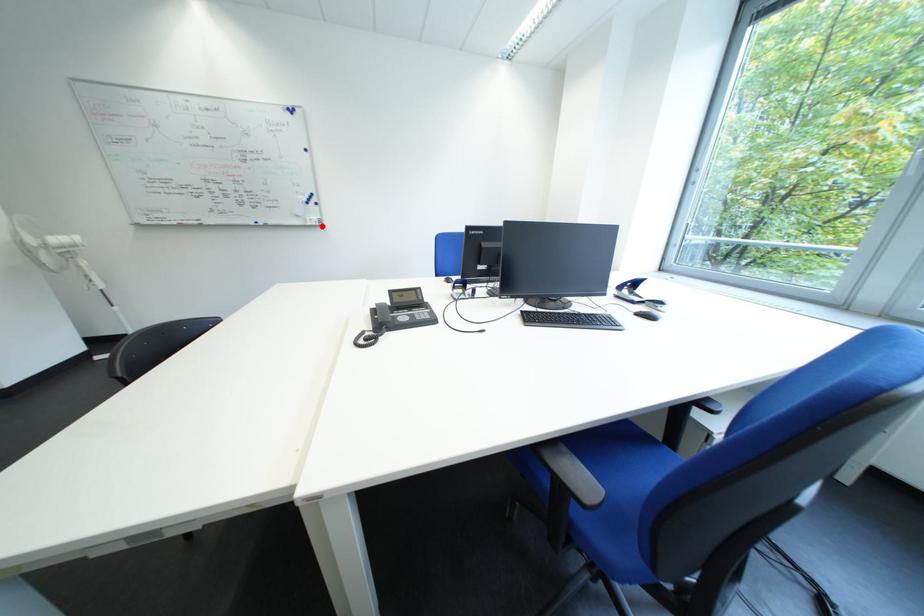
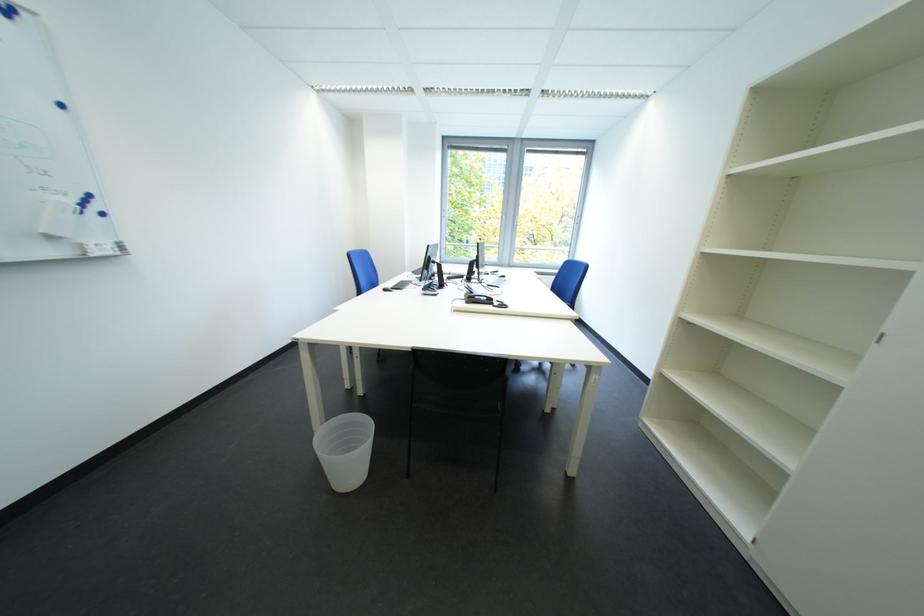
Find the pixel in the second image that matches the highlighted location in the first image.

(108, 256)